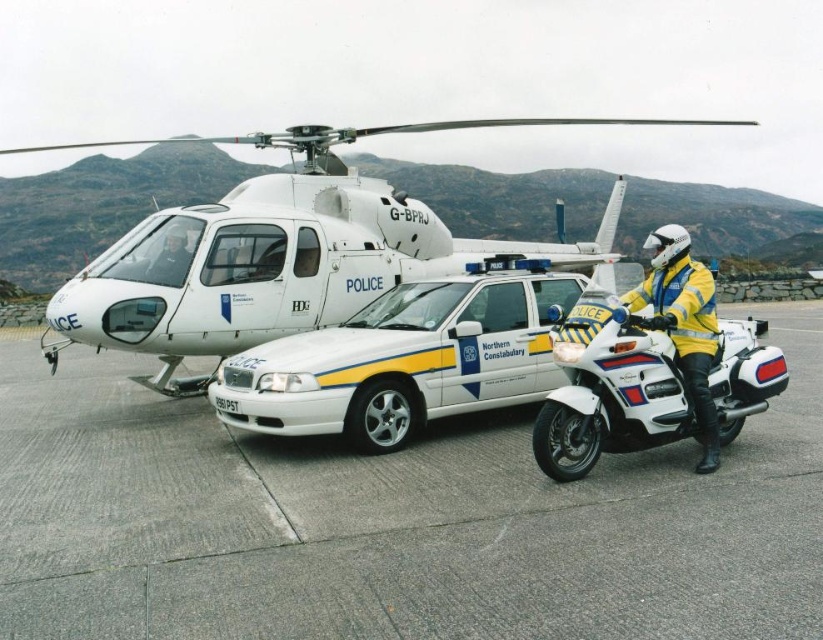
Does white glossy motorcycle at center lie behind black plastic license plate at center?

A: No, white glossy motorcycle at center is in front of black plastic license plate at center.

Is white glossy motorcycle at center positioned before black plastic license plate at center?

Yes.

Between point (636, 371) and point (228, 403), which one is positioned behind?

The point (228, 403) is behind.

In order to click on white glossy motorcycle at center in this screenshot , I will do `click(608, 387)`.

Can you confirm if white matte helicopter at upper center is positioned to the right of white glossy motorcycle at center?

No, white matte helicopter at upper center is not to the right of white glossy motorcycle at center.

Locate an element on the screen. white matte helicopter at upper center is located at coordinates (284, 252).

Locate an element on the screen. This screenshot has height=640, width=823. white matte helicopter at upper center is located at coordinates (284, 252).

Which is more to the left, gray asphalt at center or white glossy motorcycle at center?

gray asphalt at center

Is point (815, 634) positioned before point (607, 339)?

That is True.

Between point (715, 561) and point (759, 365), which one is positioned behind?

The point (759, 365) is more distant.

You are a GUI agent. You are given a task and a screenshot of the screen. Output one action in this format:
    pyautogui.click(x=<x>, y=<y>)
    Task: Click on the gray asphalt at center
    This screenshot has width=823, height=640.
    Given the screenshot: What is the action you would take?
    pyautogui.click(x=394, y=522)